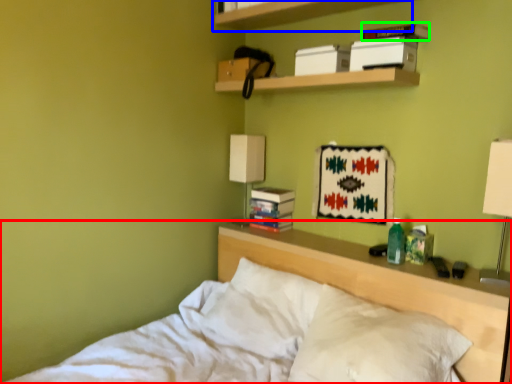
Question: Considering the real-world distances, which object is farthest from bed (highlighted by a red box)? shelf (highlighted by a blue box) or paperback book (highlighted by a green box)?

Choices:
 (A) shelf
 (B) paperback book

Answer: (A)